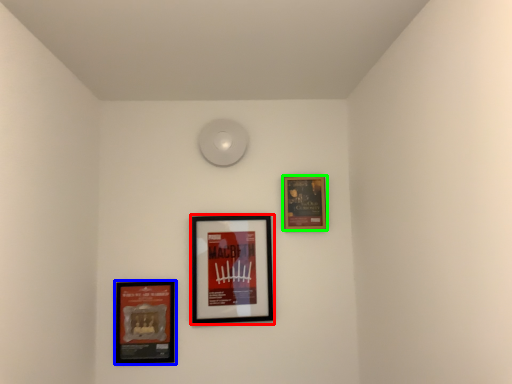
Question: Which is farther away from picture frame (highlighted by a red box)? picture frame (highlighted by a blue box) or picture frame (highlighted by a green box)?

Choices:
 (A) picture frame
 (B) picture frame

Answer: (B)